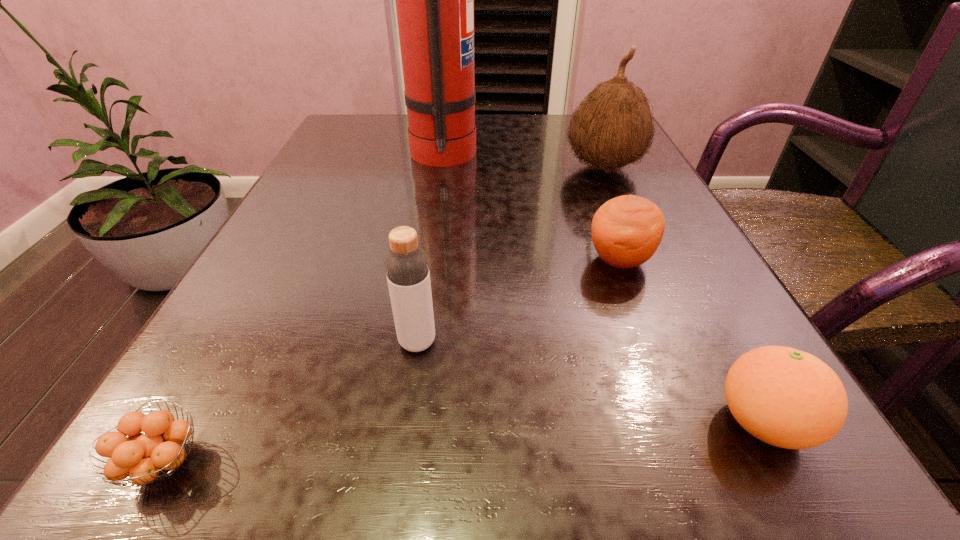
You are a GUI agent. You are given a task and a screenshot of the screen. Output one action in this format:
    pyautogui.click(x=<x>, y=<y>)
    Task: Click on the free space between the tallest object and the third nearest object
    This screenshot has height=540, width=960.
    Given the screenshot: What is the action you would take?
    pyautogui.click(x=430, y=249)

This screenshot has height=540, width=960. Find the location of `empty space that is in between the leftmost orange fruit and the farthest orange fruit`. empty space that is in between the leftmost orange fruit and the farthest orange fruit is located at coordinates pyautogui.click(x=392, y=361).

Select which object is the second closest to the leftmost object. Please provide its 2D coordinates. Your answer should be formatted as a tuple, i.e. [(x, y)], where the tuple contains the x and y coordinates of a point satisfying the conditions above.

[(626, 231)]

Select which object is the fourth closest to the leftmost orange fruit. Please provide its 2D coordinates. Your answer should be formatted as a tuple, i.e. [(x, y)], where the tuple contains the x and y coordinates of a point satisfying the conditions above.

[(434, 0)]

Identify which orange fruit is the second closest to the third farthest object. Please provide its 2D coordinates. Your answer should be formatted as a tuple, i.e. [(x, y)], where the tuple contains the x and y coordinates of a point satisfying the conditions above.

[(154, 454)]

Locate an element on the screen. the second closest orange fruit to the shortest object is located at coordinates (785, 397).

The height and width of the screenshot is (540, 960). In order to click on vacant space that satisfies the following two spatial constraints: 1. on the label side of the third nearest object; 2. on the left side of the tallest object in this screenshot , I will do `click(416, 342)`.